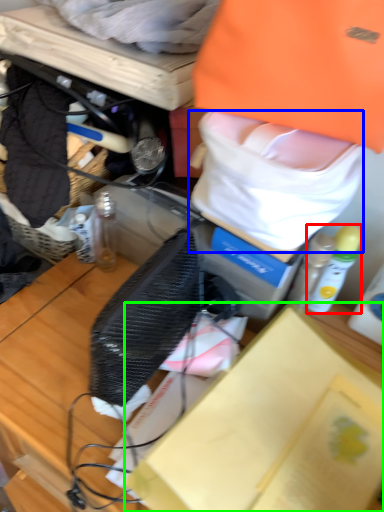
Question: Considering the real-world distances, which object is closest to bottle (highlighted by a red box)? tote bag (highlighted by a blue box) or box (highlighted by a green box).

Choices:
 (A) tote bag
 (B) box

Answer: (A)